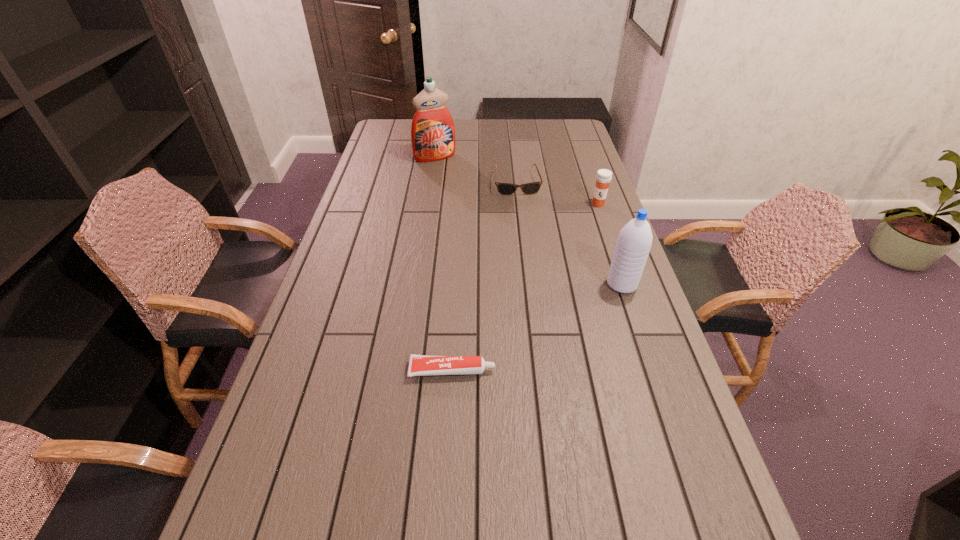
You are a GUI agent. You are given a task and a screenshot of the screen. Output one action in this format:
    pyautogui.click(x=<x>, y=<y>)
    Task: Click on the vacant area that lies between the nearest object and the third object from left to right
    
    Given the screenshot: What is the action you would take?
    pyautogui.click(x=485, y=276)

I want to click on free spot between the third shortest object and the toothpaste, so click(x=525, y=287).

Identify the location of empty space between the toothpaste and the second shortest object. 485,276.

Identify the location of free space that is in between the detergent and the third shortest object. The image size is (960, 540). (516, 180).

What are the coordinates of `vacant space that's between the medicine and the water bottle` in the screenshot? It's located at (610, 244).

Locate which object is the fourth closest to the tallest object. Please provide its 2D coordinates. Your answer should be formatted as a tuple, i.e. [(x, y)], where the tuple contains the x and y coordinates of a point satisfying the conditions above.

[(419, 365)]

The image size is (960, 540). I want to click on object that is the fourth closest to the detergent, so click(419, 365).

You are a GUI agent. You are given a task and a screenshot of the screen. Output one action in this format:
    pyautogui.click(x=<x>, y=<y>)
    Task: Click on the free space that satisfies the following two spatial constraints: 1. on the front side of the fourth tallest object; 2. on the right side of the second nearest object
    This screenshot has height=540, width=960.
    Given the screenshot: What is the action you would take?
    pyautogui.click(x=529, y=285)

Locate an element on the screen. Image resolution: width=960 pixels, height=540 pixels. free location that satisfies the following two spatial constraints: 1. on the front side of the second farthest object; 2. on the left side of the farthest object is located at coordinates (431, 183).